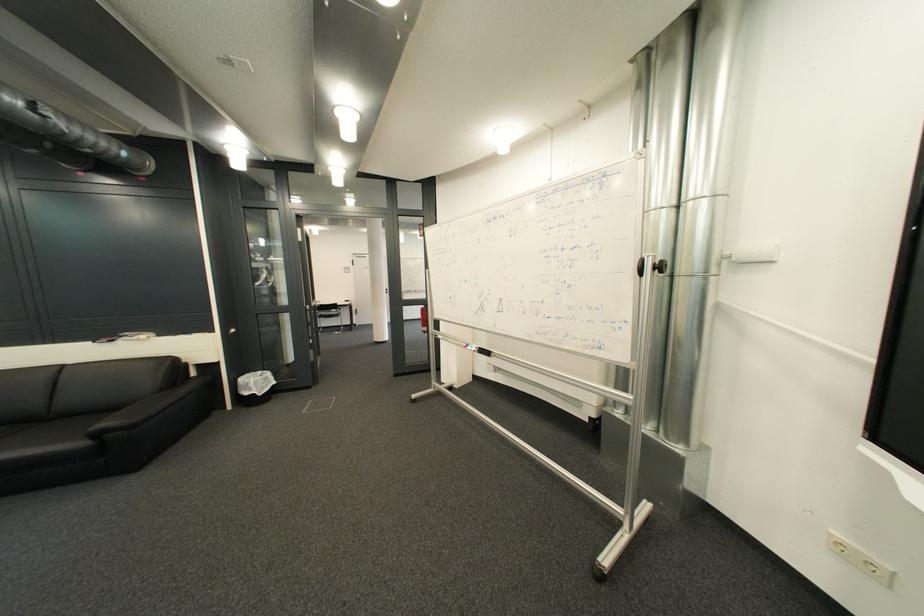
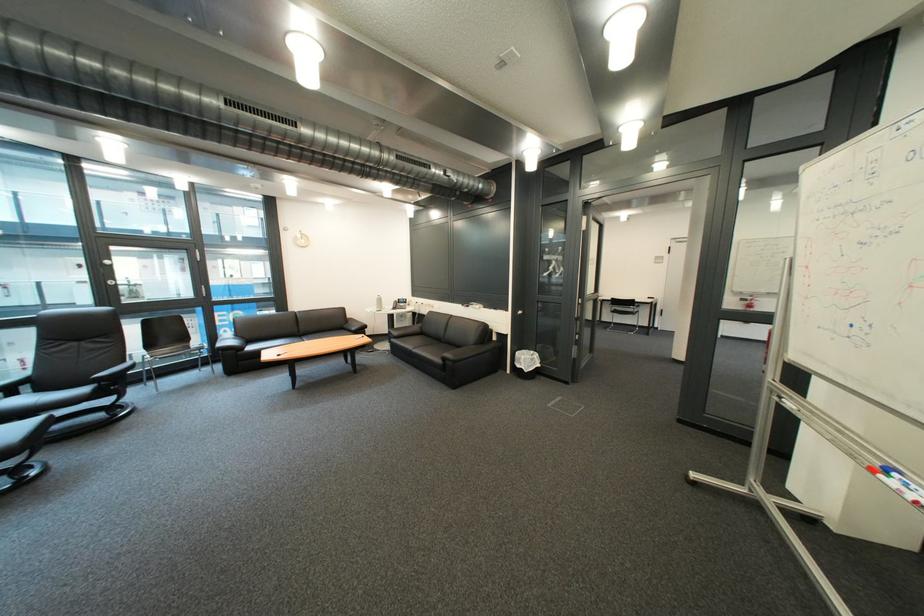
In the second image, find the point that corresponds to point 265,387 in the first image.

(536, 363)